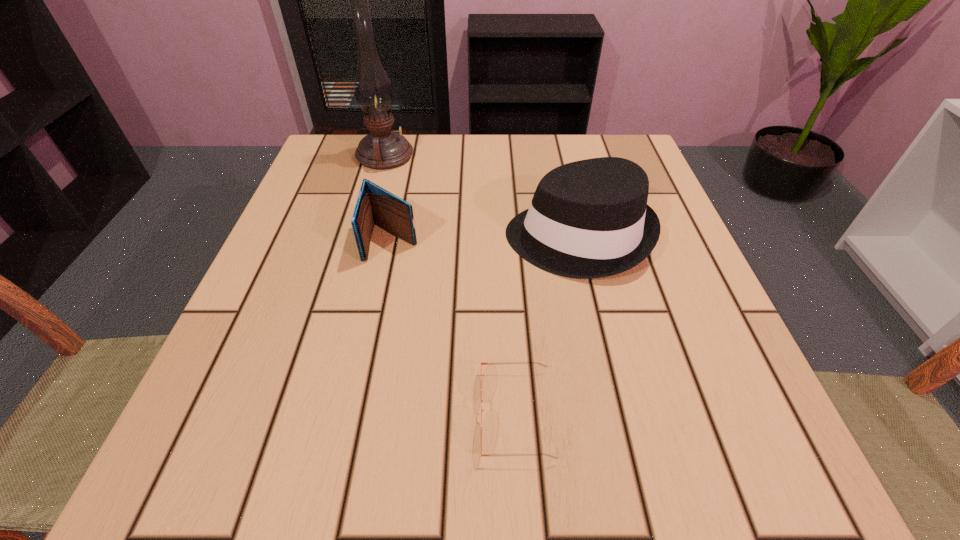
This screenshot has width=960, height=540. In order to click on the farthest object in this screenshot , I will do 383,149.

Find the location of `oil lamp`. oil lamp is located at coordinates (383, 149).

At what (x,y) coordinates should I click in order to perform the action: click on fedora. Please return your answer as a coordinate pair (x, y). This screenshot has height=540, width=960. Looking at the image, I should click on point(588,219).

Where is `the second shortest object`? The height and width of the screenshot is (540, 960). the second shortest object is located at coordinates (375, 205).

Image resolution: width=960 pixels, height=540 pixels. What are the coordinates of `the shortest object` in the screenshot? It's located at (482, 410).

I want to click on sunglasses, so click(482, 410).

Where is `vacant point located on the right of the tallest object`? The height and width of the screenshot is (540, 960). vacant point located on the right of the tallest object is located at coordinates (556, 156).

Where is `free space located 0.070m on the front of the fedora`? free space located 0.070m on the front of the fedora is located at coordinates (596, 316).

The width and height of the screenshot is (960, 540). I want to click on free space located on the exterior surface of the wallet, so click(x=341, y=492).

Where is `free region located on the face of the shortest object`? The height and width of the screenshot is (540, 960). free region located on the face of the shortest object is located at coordinates (351, 413).